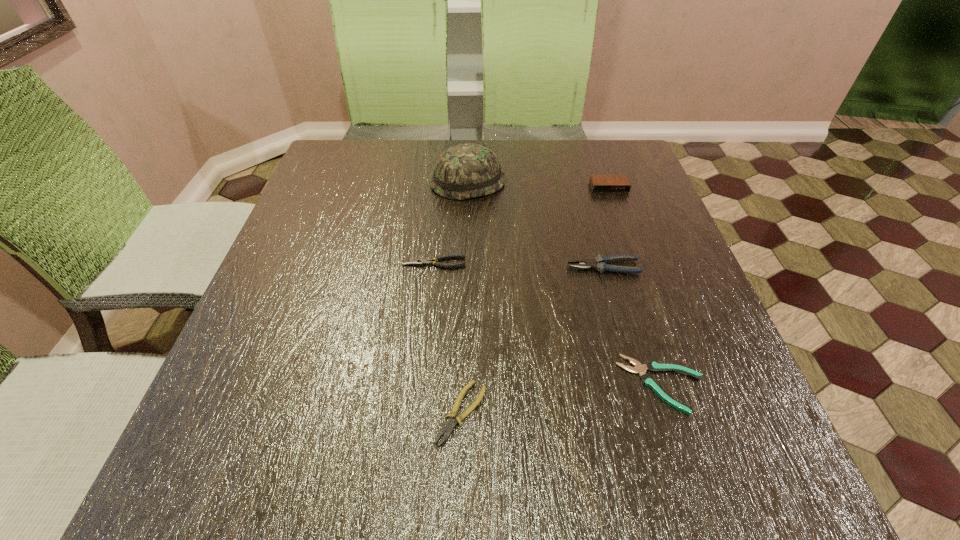
Where is `headwear that is at the far edge`? The width and height of the screenshot is (960, 540). headwear that is at the far edge is located at coordinates (464, 171).

Locate an element on the screen. This screenshot has height=540, width=960. alarm clock present at the far edge is located at coordinates (599, 183).

Where is `object located at the near edge`? object located at the near edge is located at coordinates (448, 428).

This screenshot has height=540, width=960. I want to click on alarm clock situated at the right edge, so click(599, 183).

Where is `object located in the far right corner section of the desktop`? object located in the far right corner section of the desktop is located at coordinates (599, 183).

The height and width of the screenshot is (540, 960). In the image, there is a desktop. In order to click on vacant space at the far edge in this screenshot , I will do `click(384, 161)`.

In the image, there is a desktop. At what (x,y) coordinates should I click in order to perform the action: click on vacant space at the near edge. Please return your answer as a coordinate pair (x, y). The width and height of the screenshot is (960, 540). Looking at the image, I should click on (371, 454).

You are a GUI agent. You are given a task and a screenshot of the screen. Output one action in this format:
    pyautogui.click(x=<x>, y=<y>)
    Task: Click on the vacant space at the left edge
    This screenshot has width=960, height=540.
    Given the screenshot: What is the action you would take?
    pyautogui.click(x=317, y=202)

You are a GUI agent. You are given a task and a screenshot of the screen. Output one action in this format:
    pyautogui.click(x=<x>, y=<y>)
    Task: Click on the free space at the right edge
    
    Given the screenshot: What is the action you would take?
    pyautogui.click(x=723, y=339)

The height and width of the screenshot is (540, 960). I want to click on vacant space at the far left corner of the desktop, so click(326, 178).